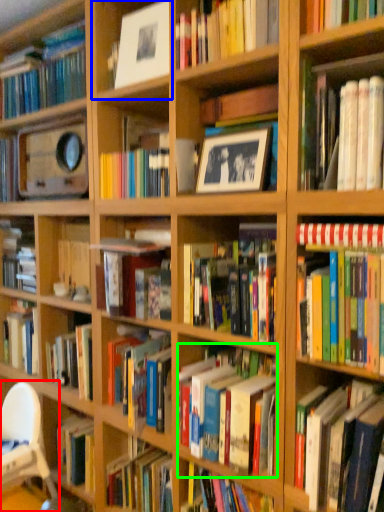
Question: Based on their relative distances, which object is nearer to chair (highlighted by a red box)? Choose from shelf (highlighted by a blue box) and book (highlighted by a green box).

Choices:
 (A) shelf
 (B) book

Answer: (B)